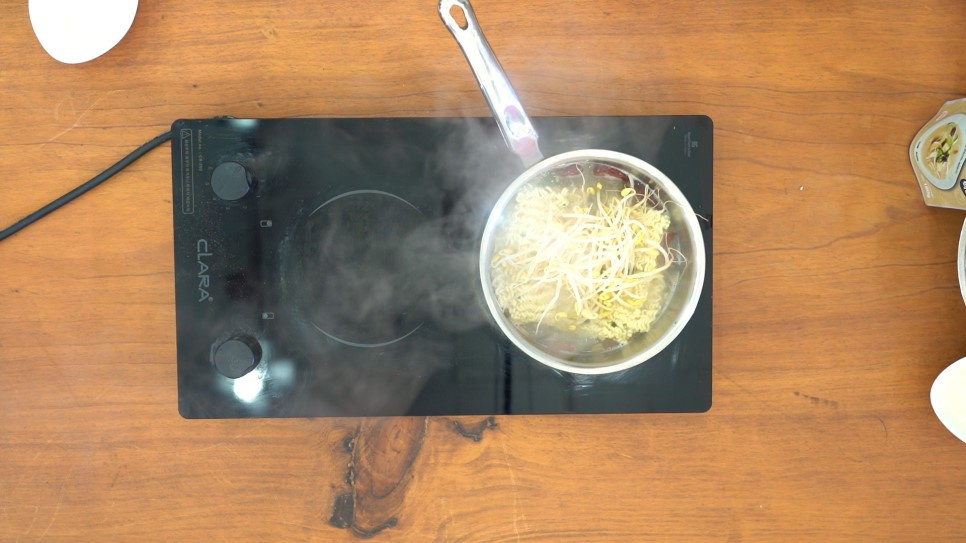
Where is `wooden table`? Image resolution: width=966 pixels, height=543 pixels. wooden table is located at coordinates (816, 306).